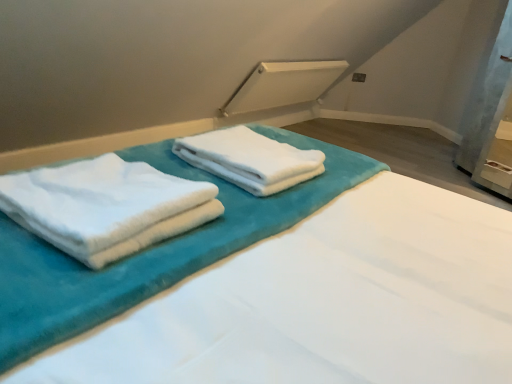
Locate an element on the screen. The width and height of the screenshot is (512, 384). white soft towels at center is located at coordinates (325, 303).

Which object is positioned more to the left, white fluffy towels at left, the 1th towel in the front-to-back sequence, or white soft towel at center, arranged as the second towel when viewed from the front?

white fluffy towels at left, the 1th towel in the front-to-back sequence.

Is white fluffy towels at left, the second towel positioned from the back, with white soft towel at center, which is the first towel in back-to-front order?

No, white fluffy towels at left, the second towel positioned from the back, is not with white soft towel at center, which is the first towel in back-to-front order.

Is white fluffy towels at left, the second towel positioned from the back, bigger than white soft towel at center, arranged as the second towel when viewed from the front?

Indeed, white fluffy towels at left, the second towel positioned from the back, has a larger size compared to white soft towel at center, arranged as the second towel when viewed from the front.

From a real-world perspective, is white fluffy towels at left, the 1th towel in the front-to-back sequence, over white soft towel at center, which is the first towel in back-to-front order?

Correct, in the physical world, white fluffy towels at left, the 1th towel in the front-to-back sequence, is higher than white soft towel at center, which is the first towel in back-to-front order.

Considering the sizes of objects white fluffy towels at left, the second towel positioned from the back, and white soft towels at center in the image provided, who is shorter, white fluffy towels at left, the second towel positioned from the back, or white soft towels at center?

white fluffy towels at left, the second towel positioned from the back, is shorter.

Which of these two, white fluffy towels at left, the second towel positioned from the back, or white soft towels at center, is thinner?

white fluffy towels at left, the second towel positioned from the back.

How many degrees apart are the facing directions of white fluffy towels at left, the 1th towel in the front-to-back sequence, and white soft towels at center?

0.968 degrees.

From a real-world perspective, is white fluffy towels at left, the 1th towel in the front-to-back sequence, positioned above or below white soft towels at center?

Clearly, from a real-world perspective, white fluffy towels at left, the 1th towel in the front-to-back sequence, is below white soft towels at center.

From the image's perspective, is white soft towels at center positioned above or below white fluffy towels at left, the 1th towel in the front-to-back sequence?

From the image's perspective, white soft towels at center appears above white fluffy towels at left, the 1th towel in the front-to-back sequence.

How far apart are white soft towels at center and white fluffy towels at left, the 1th towel in the front-to-back sequence?

They are 7.85 inches apart.

Do you think white soft towels at center is within white fluffy towels at left, the 1th towel in the front-to-back sequence, or outside of it?

white soft towels at center cannot be found inside white fluffy towels at left, the 1th towel in the front-to-back sequence.

From a real-world perspective, is white soft towels at center over white fluffy towels at left, the second towel positioned from the back?

Correct, in the physical world, white soft towels at center is higher than white fluffy towels at left, the second towel positioned from the back.

Looking at this image, which point is more distant from viewer, (480, 366) or (269, 162)?

The point (269, 162) is farther.

Considering the sizes of objects white soft towels at center and white soft towel at center, arranged as the second towel when viewed from the front, in the image provided, who is bigger, white soft towels at center or white soft towel at center, arranged as the second towel when viewed from the front,?

white soft towels at center.

Can you confirm if white soft towels at center is positioned to the right of white soft towel at center, arranged as the second towel when viewed from the front?

Indeed, white soft towels at center is positioned on the right side of white soft towel at center, arranged as the second towel when viewed from the front.

From a real-world perspective, which object rests below the other?

white soft towel at center, which is the first towel in back-to-front order, is physically lower.

From the image's perspective, does white soft towel at center, arranged as the second towel when viewed from the front, appear lower than white soft towels at center?

Yes.

Between white soft towel at center, which is the first towel in back-to-front order, and white soft towels at center, which one has smaller width?

white soft towel at center, which is the first towel in back-to-front order, is thinner.

Is white soft towel at center, which is the first towel in back-to-front order, to the left of white soft towels at center from the viewer's perspective?

Correct, you'll find white soft towel at center, which is the first towel in back-to-front order, to the left of white soft towels at center.

Is white soft towel at center, which is the first towel in back-to-front order, oriented away from white soft towels at center?

Yes, white soft towels at center is at the back of white soft towel at center, which is the first towel in back-to-front order.

Can you confirm if white soft towel at center, arranged as the second towel when viewed from the front, is bigger than white fluffy towels at left, the 1th towel in the front-to-back sequence?

Incorrect, white soft towel at center, arranged as the second towel when viewed from the front, is not larger than white fluffy towels at left, the 1th towel in the front-to-back sequence.

Is white fluffy towels at left, the 1th towel in the front-to-back sequence, located within white soft towel at center, which is the first towel in back-to-front order?

That's incorrect, white fluffy towels at left, the 1th towel in the front-to-back sequence, is not inside white soft towel at center, which is the first towel in back-to-front order.

Between point (265, 172) and point (41, 204), which one is positioned in front?

Positioned in front is point (41, 204).

What's the angular difference between white soft towel at center, arranged as the second towel when viewed from the front, and white fluffy towels at left, the 1th towel in the front-to-back sequence,'s facing directions?

The facing directions of white soft towel at center, arranged as the second towel when viewed from the front, and white fluffy towels at left, the 1th towel in the front-to-back sequence, are 1.61 degrees apart.

In order to click on towel in front of the white soft towel at center, which is the first towel in back-to-front order in this screenshot , I will do `click(106, 206)`.

There is a white soft towels at center. Where is `the 1st towel below it (from a real-world perspective)`? This screenshot has width=512, height=384. the 1st towel below it (from a real-world perspective) is located at coordinates (106, 206).

When comparing their distances from white soft towels at center, does white fluffy towels at left, the 1th towel in the front-to-back sequence, or white soft towel at center, which is the first towel in back-to-front order, seem further?

white fluffy towels at left, the 1th towel in the front-to-back sequence, is further to white soft towels at center.

Based on their spatial positions, is white soft towel at center, arranged as the second towel when viewed from the front, or white fluffy towels at left, the second towel positioned from the back, closer to white soft towels at center?

white soft towel at center, arranged as the second towel when viewed from the front.

Estimate the real-world distances between objects in this image. Which object is further from white soft towel at center, which is the first towel in back-to-front order, white soft towels at center or white fluffy towels at left, the 1th towel in the front-to-back sequence?

white fluffy towels at left, the 1th towel in the front-to-back sequence, lies further to white soft towel at center, which is the first towel in back-to-front order, than the other object.

In the scene shown: Estimate the real-world distances between objects in this image. Which object is further from white soft towel at center, arranged as the second towel when viewed from the front, white fluffy towels at left, the second towel positioned from the back, or white soft towels at center?

Among the two, white fluffy towels at left, the second towel positioned from the back, is located further to white soft towel at center, arranged as the second towel when viewed from the front.

When comparing their distances from white fluffy towels at left, the second towel positioned from the back, does white soft towel at center, which is the first towel in back-to-front order, or white soft towels at center seem closer?

white soft towels at center is positioned closer to the anchor white fluffy towels at left, the second towel positioned from the back.

Which object lies further to the anchor point white fluffy towels at left, the 1th towel in the front-to-back sequence, white soft towels at center or white soft towel at center, arranged as the second towel when viewed from the front?

The object further to white fluffy towels at left, the 1th towel in the front-to-back sequence, is white soft towel at center, arranged as the second towel when viewed from the front.

At what (x,y) coordinates should I click in order to perform the action: click on towel between white soft towels at center and white soft towel at center, arranged as the second towel when viewed from the front, along the z-axis. Please return your answer as a coordinate pair (x, y). Looking at the image, I should click on (106, 206).